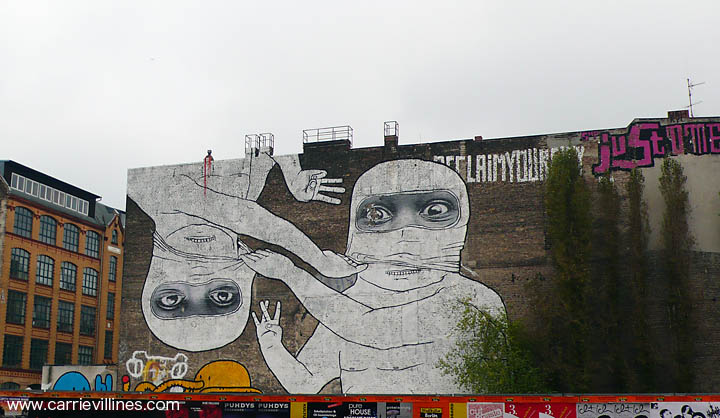
I want to click on art, so click(171, 295).